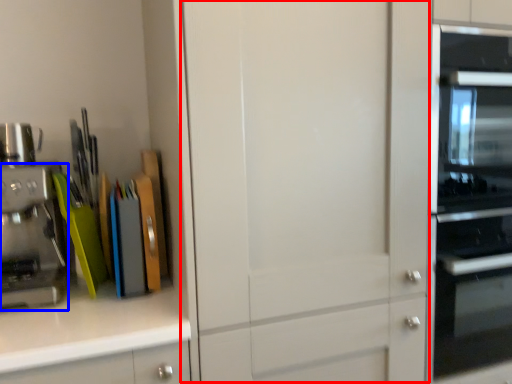
Question: Which of the following is the farthest to the observer, glass door (highlighted by a red box) or kitchen appliance (highlighted by a blue box)?

Choices:
 (A) glass door
 (B) kitchen appliance

Answer: (B)